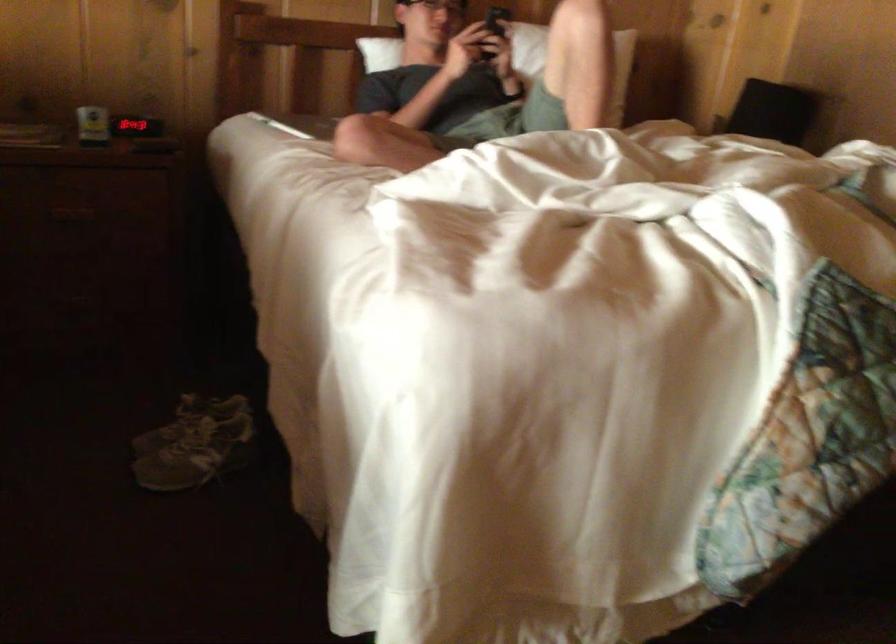
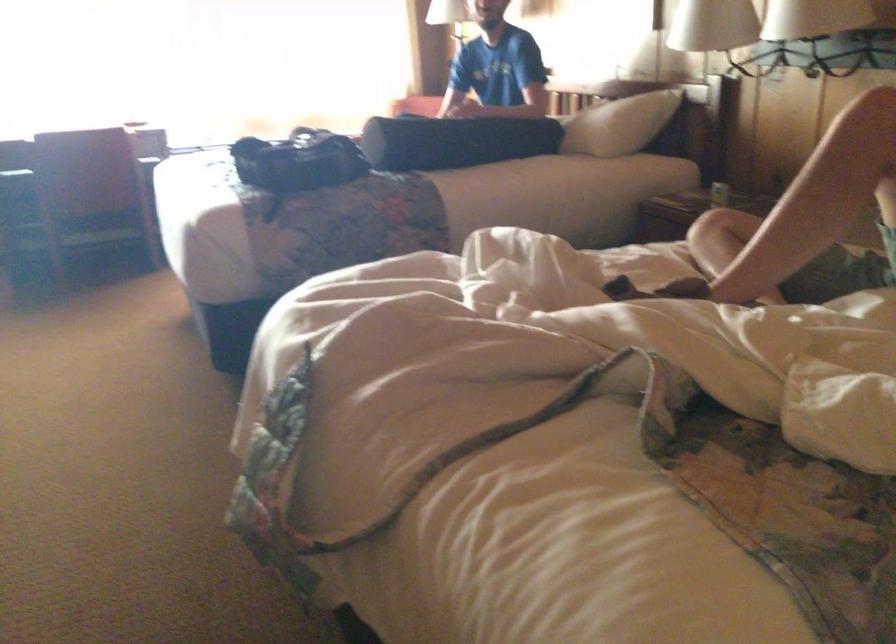
Locate, in the second image, the point that corresponds to point (138, 131) in the first image.

(719, 194)